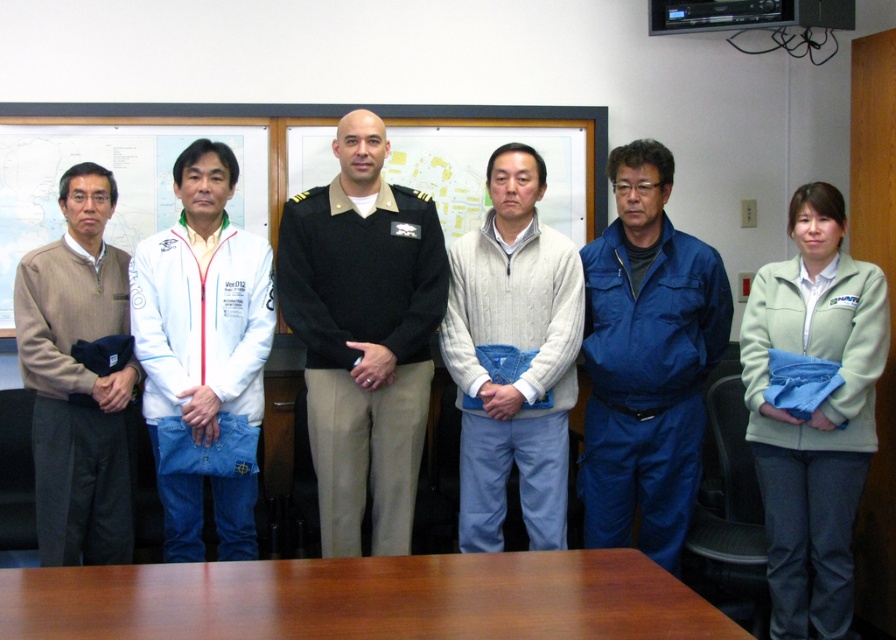
Locate an element on the screen. black uniform at center is located at coordinates (363, 333).

Who is more distant from viewer, (x=376, y=157) or (x=247, y=273)?

Point (x=247, y=273)

At what (x,y) coordinates should I click in order to perform the action: click on black uniform at center. Please return your answer as a coordinate pair (x, y). Looking at the image, I should click on (363, 333).

Which of these two, beige textured sweater at left or matte white board at left, stands taller?

With more height is beige textured sweater at left.

Measure the distance from beige textured sweater at left to matte white board at left.

A distance of 25.97 inches exists between beige textured sweater at left and matte white board at left.

Between point (74, 266) and point (13, 198), which one is positioned in front?

Point (74, 266) is more forward.

I want to click on beige textured sweater at left, so click(76, 380).

Is blue fabric jumpsuit at center positioned in front of light green fleece jacket at center?

No, it is not.

Who is more forward, (694, 356) or (814, 195)?

Positioned in front is point (814, 195).

Image resolution: width=896 pixels, height=640 pixels. Find the location of `blue fabric jumpsuit at center`. blue fabric jumpsuit at center is located at coordinates (645, 360).